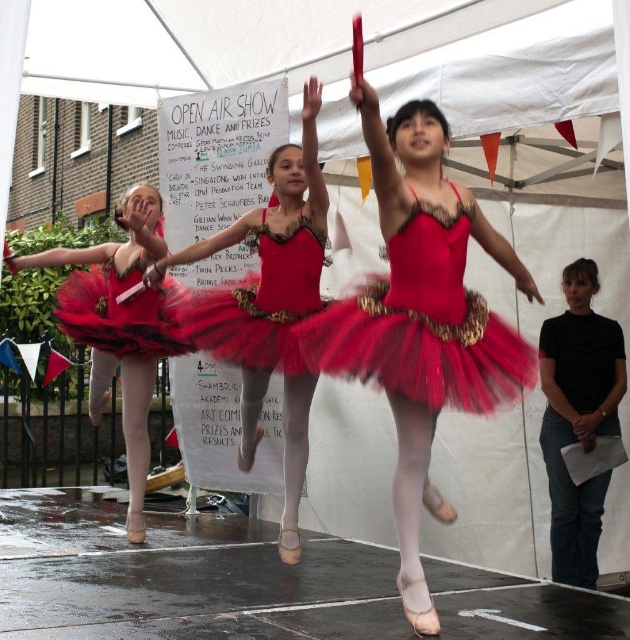
You are a photographer at the Open Air Show event. You want to capture a closeup shot of the ballerina at point (x=575, y=572) and the one at point (x=164, y=280). Which ballerina will appear larger in your photo?

The ballerina at point (x=575, y=572) will appear larger in the photo because she is closer to the camera than the ballerina at point (x=164, y=280).

You are a photographer at the Open Air Show event. You want to capture a photo of the matte black ballet dancer at center and the red tulle tutu at left. Based on their positions, which one should you focus on first if you want to include both in the frame without moving the camera?

The matte black ballet dancer at center is located below the red tulle tutu at left, so you should focus on the red tulle tutu at left first to ensure both are in the frame without moving the camera.